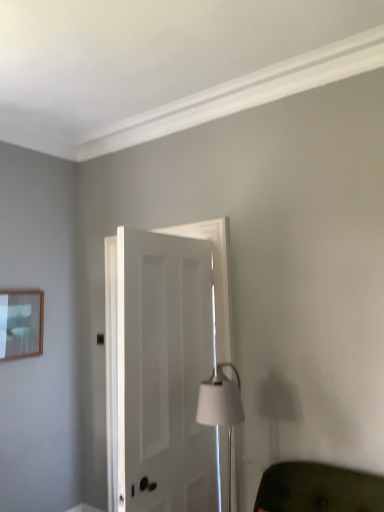
Question: Does white matte door at center lie behind wooden picture frame at upper left?

Choices:
 (A) yes
 (B) no

Answer: (B)

Question: Is white matte door at center far away from wooden picture frame at upper left?

Choices:
 (A) yes
 (B) no

Answer: (A)

Question: Is wooden picture frame at upper left inside white matte door at center?

Choices:
 (A) no
 (B) yes

Answer: (A)

Question: From a real-world perspective, is white matte door at center below wooden picture frame at upper left?

Choices:
 (A) yes
 (B) no

Answer: (A)

Question: Is white matte door at center closer to the viewer compared to wooden picture frame at upper left?

Choices:
 (A) no
 (B) yes

Answer: (B)

Question: Can you confirm if white matte door at center is positioned to the right of wooden picture frame at upper left?

Choices:
 (A) yes
 (B) no

Answer: (A)

Question: Does wooden picture frame at upper left have a greater width compared to white matte door at center?

Choices:
 (A) no
 (B) yes

Answer: (A)

Question: Is white matte door at center a part of wooden picture frame at upper left?

Choices:
 (A) yes
 (B) no

Answer: (B)

Question: Can you confirm if wooden picture frame at upper left is positioned to the left of white matte door at center?

Choices:
 (A) no
 (B) yes

Answer: (B)

Question: From a real-world perspective, is wooden picture frame at upper left positioned under white matte door at center based on gravity?

Choices:
 (A) yes
 (B) no

Answer: (B)

Question: Does wooden picture frame at upper left appear on the right side of white matte door at center?

Choices:
 (A) no
 (B) yes

Answer: (A)

Question: Does wooden picture frame at upper left have a lesser height compared to white matte door at center?

Choices:
 (A) yes
 (B) no

Answer: (A)

Question: Does wooden picture frame at upper left appear on the left side of white matte table lamp at center?

Choices:
 (A) no
 (B) yes

Answer: (B)